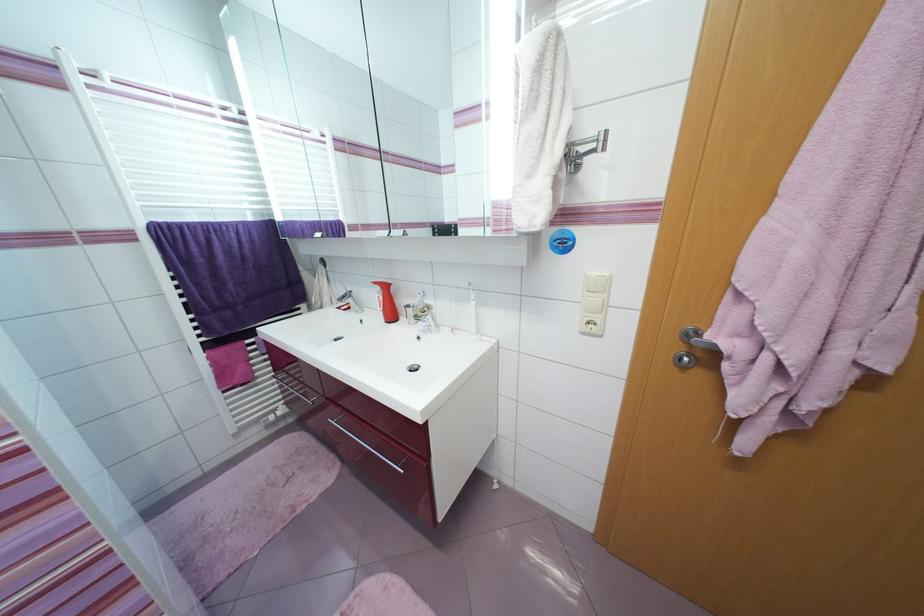
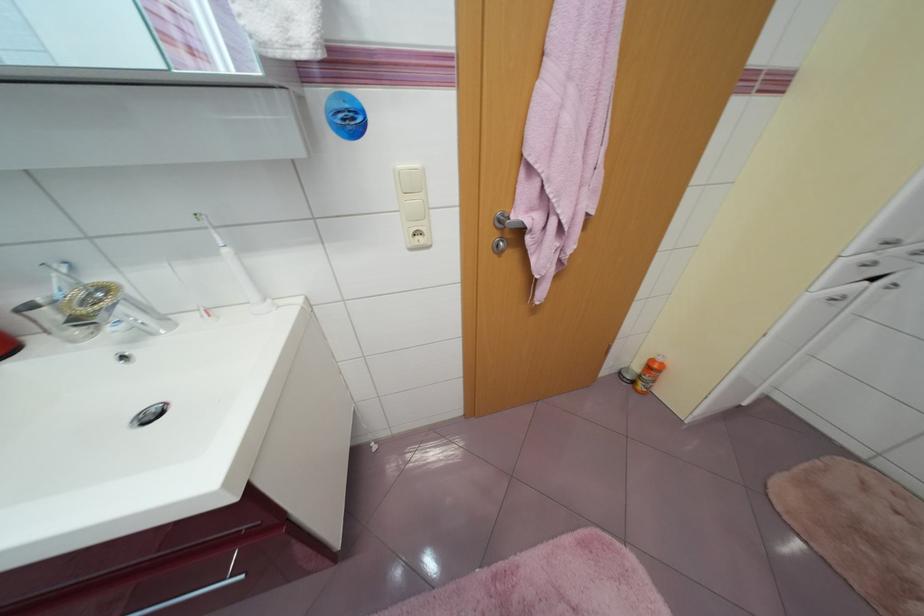
In the scene shown: The images are taken continuously from a first-person perspective. In which direction is your viewpoint rotating?

The camera rotated toward right-down.